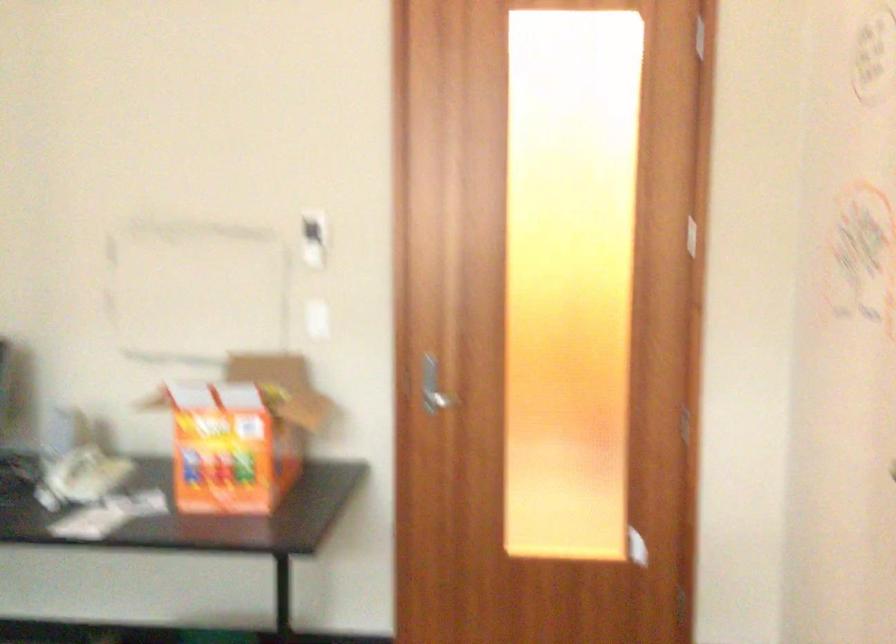
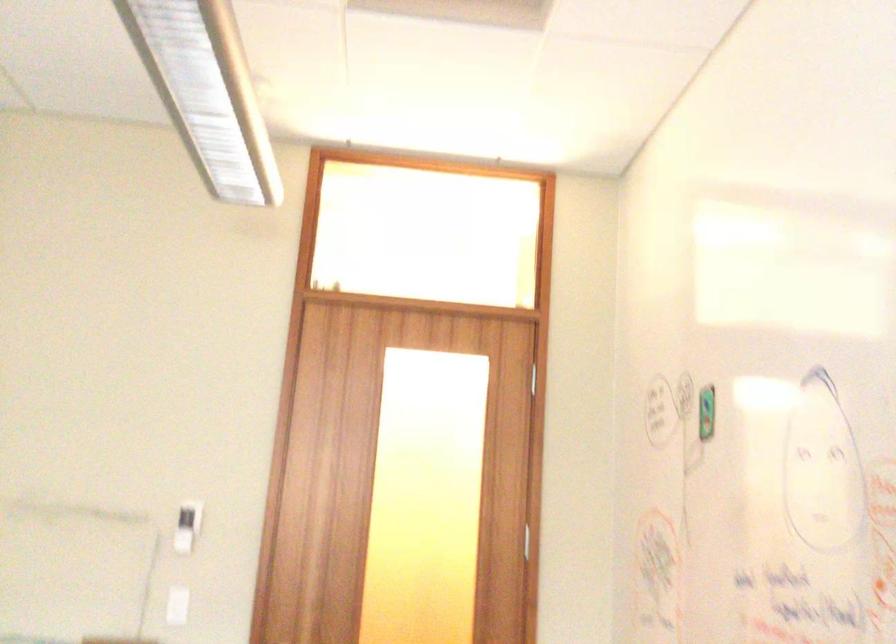
Question: Based on the continuous images, in which direction is the camera rotating? Reply with the corresponding letter.

Choices:
 (A) Left
 (B) Right
 (C) Up
 (D) Down

Answer: (C)